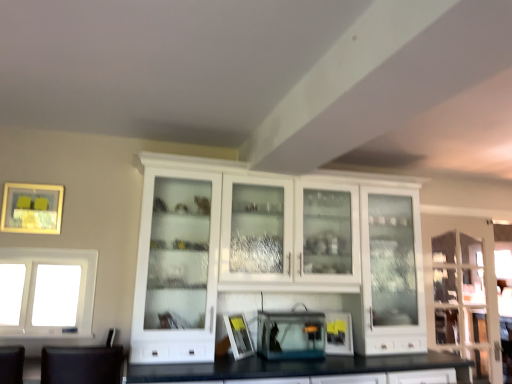
Question: From a real-world perspective, is white glass cabinet at center positioned above or below matte gold picture frame at upper left, which is the second picture frame from right to left?

Choices:
 (A) below
 (B) above

Answer: (A)

Question: Is point (395, 238) closer or farther from the camera than point (5, 192)?

Choices:
 (A) farther
 (B) closer

Answer: (A)

Question: Estimate the real-world distances between objects in this image. Which object is closer to the white matte picture frame at center, which is the 1th picture frame in bottom-to-top order?

Choices:
 (A) white glass cabinet at center
 (B) transparent plastic aquarium at center, the 1th appliance when ordered from left to right
 (C) matte black toaster at center, which ranks as the 2th appliance in left-to-right order
 (D) white glass window at left
 (E) matte gold picture frame at upper left, the first picture frame in the top-to-bottom sequence

Answer: (B)

Question: Which of these objects is positioned farthest from the matte gold picture frame at upper left, which is the second picture frame from right to left?

Choices:
 (A) transparent plastic aquarium at center, the 1th appliance when ordered from left to right
 (B) matte black toaster at center, the 1th appliance in the right-to-left sequence
 (C) clear glass cabinet at right
 (D) white matte picture frame at center, which is the 1th picture frame in bottom-to-top order
 (E) white glass window at left

Answer: (C)